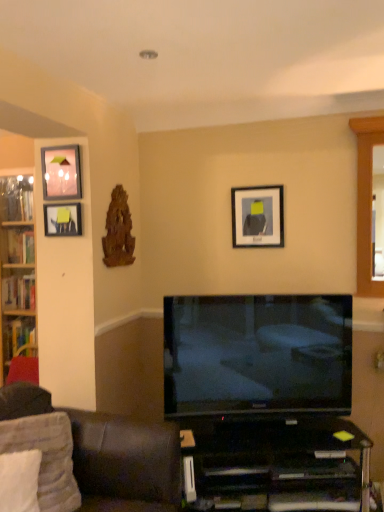
Locate an element on the screen. black glossy desk at lower center is located at coordinates (274, 464).

What do you see at coordinates (274, 464) in the screenshot? I see `black glossy desk at lower center` at bounding box center [274, 464].

What do you see at coordinates (62, 219) in the screenshot?
I see `matte black picture frame at left, which is counted as the 2th picture frame, starting from the front` at bounding box center [62, 219].

What do you see at coordinates (61, 172) in the screenshot?
I see `matte glass picture frame at upper left, the 1th picture frame in the front-to-back sequence` at bounding box center [61, 172].

Where is `white fabric pillow at lower left, placed as the 1th pillow when sorted from back to front`? The width and height of the screenshot is (384, 512). white fabric pillow at lower left, placed as the 1th pillow when sorted from back to front is located at coordinates (46, 457).

What do you see at coordinates (257, 216) in the screenshot?
I see `matte black picture frame at upper center, which appears as the third picture frame when viewed from the front` at bounding box center [257, 216].

In order to click on white soft pillow at lower left, placed as the 1th pillow when sorted from front to back in this screenshot , I will do `click(19, 481)`.

You are a GUI agent. You are given a task and a screenshot of the screen. Output one action in this format:
    pyautogui.click(x=<x>, y=<y>)
    Task: Click on the black glossy desk at lower center
    
    Given the screenshot: What is the action you would take?
    pyautogui.click(x=274, y=464)

What's the angular difference between flat screen tv at center and dark brown leather couch at lower left's facing directions?

The angular difference between flat screen tv at center and dark brown leather couch at lower left is 67.8 degrees.

From the picture: Is flat screen tv at center inside the boundaries of dark brown leather couch at lower left, or outside?

flat screen tv at center lies outside dark brown leather couch at lower left.

From a real-world perspective, relative to dark brown leather couch at lower left, is flat screen tv at center vertically above or below?

From a real-world perspective, flat screen tv at center is physically above dark brown leather couch at lower left.

Is matte black picture frame at left, which is the 1th picture frame in left-to-right order, inside the boundaries of matte glass picture frame at upper left, which is the second picture frame in right-to-left order, or outside?

The correct answer is: outside.

Is matte black picture frame at left, which is the 1th picture frame in left-to-right order, facing towards matte glass picture frame at upper left, the 1th picture frame in the front-to-back sequence?

No, matte black picture frame at left, which is the 1th picture frame in left-to-right order, is not turned towards matte glass picture frame at upper left, the 1th picture frame in the front-to-back sequence.

Is matte black picture frame at left, which is counted as the 2th picture frame, starting from the front, placed right next to matte glass picture frame at upper left, the 1th picture frame in the front-to-back sequence?

No, matte black picture frame at left, which is counted as the 2th picture frame, starting from the front, is not beside matte glass picture frame at upper left, the 1th picture frame in the front-to-back sequence.

Considering their positions, is matte black picture frame at left, the third picture frame when ordered from right to left, located in front of or behind matte glass picture frame at upper left, the third picture frame in the back-to-front sequence?

matte black picture frame at left, the third picture frame when ordered from right to left, is behind matte glass picture frame at upper left, the third picture frame in the back-to-front sequence.

Can you confirm if flat screen tv at center is bigger than matte glass picture frame at upper left, the 1th picture frame in the front-to-back sequence?

Correct, flat screen tv at center is larger in size than matte glass picture frame at upper left, the 1th picture frame in the front-to-back sequence.

Between flat screen tv at center and matte glass picture frame at upper left, which is the second picture frame in right-to-left order, which one has more height?

flat screen tv at center.

Considering the positions of objects flat screen tv at center and matte glass picture frame at upper left, which is the second picture frame in right-to-left order, in the image provided, who is more to the left, flat screen tv at center or matte glass picture frame at upper left, which is the second picture frame in right-to-left order,?

From the viewer's perspective, matte glass picture frame at upper left, which is the second picture frame in right-to-left order, appears more on the left side.

From their relative heights in the image, would you say matte glass picture frame at upper left, the second picture frame when ordered from left to right, is taller or shorter than flat screen tv at center?

Clearly, matte glass picture frame at upper left, the second picture frame when ordered from left to right, is shorter compared to flat screen tv at center.

Identify the location of television below the matte glass picture frame at upper left, the 1th picture frame in the front-to-back sequence (from a real-world perspective). The image size is (384, 512). (257, 354).

Is point (64, 180) less distant than point (218, 401)?

No, it is behind (218, 401).

Does matte glass picture frame at upper left, the second picture frame when ordered from left to right, have a smaller size compared to flat screen tv at center?

Yes.

Is dark brown leather couch at lower left in contact with matte glass picture frame at upper left, the second picture frame when ordered from left to right?

No, dark brown leather couch at lower left is not touching matte glass picture frame at upper left, the second picture frame when ordered from left to right.

Based on the photo, can you tell me how much dark brown leather couch at lower left and matte glass picture frame at upper left, which is the second picture frame in right-to-left order, differ in facing direction?

dark brown leather couch at lower left and matte glass picture frame at upper left, which is the second picture frame in right-to-left order, are facing 90.2 degrees away from each other.

From a real-world perspective, is dark brown leather couch at lower left above or below matte glass picture frame at upper left, the third picture frame in the back-to-front sequence?

In terms of real-world spatial position, dark brown leather couch at lower left is below matte glass picture frame at upper left, the third picture frame in the back-to-front sequence.

Does point (169, 430) appear closer or farther from the camera than point (48, 189)?

Point (169, 430).

Which object is wider, black glossy desk at lower center or dark brown leather couch at lower left?

dark brown leather couch at lower left.

Between point (317, 423) and point (178, 494), which one is positioned in front?

The point (178, 494) is more forward.

Identify the location of desk that is on the right side of dark brown leather couch at lower left. Image resolution: width=384 pixels, height=512 pixels. (274, 464).

How many degrees apart are the facing directions of black glossy desk at lower center and dark brown leather couch at lower left?

69.4 degrees separate the facing orientations of black glossy desk at lower center and dark brown leather couch at lower left.

How far apart are dark brown leather couch at lower left and wooden bookshelf at left?

dark brown leather couch at lower left is 3.63 feet from wooden bookshelf at left.

The width and height of the screenshot is (384, 512). In order to click on cabinetry above the dark brown leather couch at lower left (from a real-world perspective) in this screenshot , I will do `click(17, 271)`.

In the scene shown: Is dark brown leather couch at lower left oriented towards wooden bookshelf at left?

No, dark brown leather couch at lower left is not turned towards wooden bookshelf at left.

This screenshot has width=384, height=512. I want to click on television above the dark brown leather couch at lower left (from the image's perspective), so click(x=257, y=354).

From the image's perspective, starting from the matte glass picture frame at upper left, the 1th picture frame in the front-to-back sequence, which picture frame is the 2nd one below? Please provide its 2D coordinates.

[(62, 219)]

Based on their spatial positions, is black glossy desk at lower center or wooden bookshelf at left closer to white soft pillow at lower left, placed as the 1th pillow when sorted from front to back?

The object closer to white soft pillow at lower left, placed as the 1th pillow when sorted from front to back, is black glossy desk at lower center.

Based on their spatial positions, is matte black picture frame at left, the third picture frame when ordered from right to left, or white soft pillow at lower left, placed as the 1th pillow when sorted from front to back, closer to matte glass picture frame at upper left, the second picture frame when ordered from left to right?

Based on the image, matte black picture frame at left, the third picture frame when ordered from right to left, appears to be nearer to matte glass picture frame at upper left, the second picture frame when ordered from left to right.

Looking at the image, which one is located closer to wooden bookshelf at left, dark brown leather couch at lower left or black glossy desk at lower center?

Among the two, dark brown leather couch at lower left is located nearer to wooden bookshelf at left.

In the scene shown: Looking at the image, which one is located closer to white soft pillow at lower left, placed as the 1th pillow when sorted from front to back, matte black picture frame at left, positioned as the second picture frame in back-to-front order, or black glossy desk at lower center?

black glossy desk at lower center.

Looking at the image, which one is located further to flat screen tv at center, matte black picture frame at left, which is counted as the 2th picture frame, starting from the front, or matte glass picture frame at upper left, the second picture frame when ordered from left to right?

Among the two, matte glass picture frame at upper left, the second picture frame when ordered from left to right, is located further to flat screen tv at center.

Considering their positions, is wooden bookshelf at left positioned closer to matte black picture frame at left, the third picture frame when ordered from right to left, than dark brown leather couch at lower left?

The object closer to matte black picture frame at left, the third picture frame when ordered from right to left, is wooden bookshelf at left.

Based on their spatial positions, is flat screen tv at center or matte black picture frame at left, positioned as the second picture frame in back-to-front order, closer to white soft pillow at lower left, which ranks as the 2th pillow in back-to-front order?

Among the two, flat screen tv at center is located nearer to white soft pillow at lower left, which ranks as the 2th pillow in back-to-front order.

Estimate the real-world distances between objects in this image. Which object is closer to wooden bookshelf at left, white soft pillow at lower left, which ranks as the 2th pillow in back-to-front order, or black glossy desk at lower center?

white soft pillow at lower left, which ranks as the 2th pillow in back-to-front order, lies closer to wooden bookshelf at left than the other object.

Where is `cabinetry that lies between matte glass picture frame at upper left, the third picture frame in the back-to-front sequence, and black glossy desk at lower center from top to bottom`? cabinetry that lies between matte glass picture frame at upper left, the third picture frame in the back-to-front sequence, and black glossy desk at lower center from top to bottom is located at coordinates (17, 271).

The height and width of the screenshot is (512, 384). Find the location of `studio couch that lies between matte glass picture frame at upper left, the 1th picture frame in the front-to-back sequence, and black glossy desk at lower center from top to bottom`. studio couch that lies between matte glass picture frame at upper left, the 1th picture frame in the front-to-back sequence, and black glossy desk at lower center from top to bottom is located at coordinates (110, 454).

You are a GUI agent. You are given a task and a screenshot of the screen. Output one action in this format:
    pyautogui.click(x=<x>, y=<y>)
    Task: Click on the picture frame located between matte black picture frame at left, which is counted as the 2th picture frame, starting from the front, and flat screen tv at center in the left-right direction
    The height and width of the screenshot is (512, 384).
    Given the screenshot: What is the action you would take?
    pyautogui.click(x=61, y=172)

Find the location of a particular element. This screenshot has height=512, width=384. pillow between matte glass picture frame at upper left, which is the second picture frame in right-to-left order, and white soft pillow at lower left, which ranks as the 2th pillow in back-to-front order, vertically is located at coordinates (46, 457).